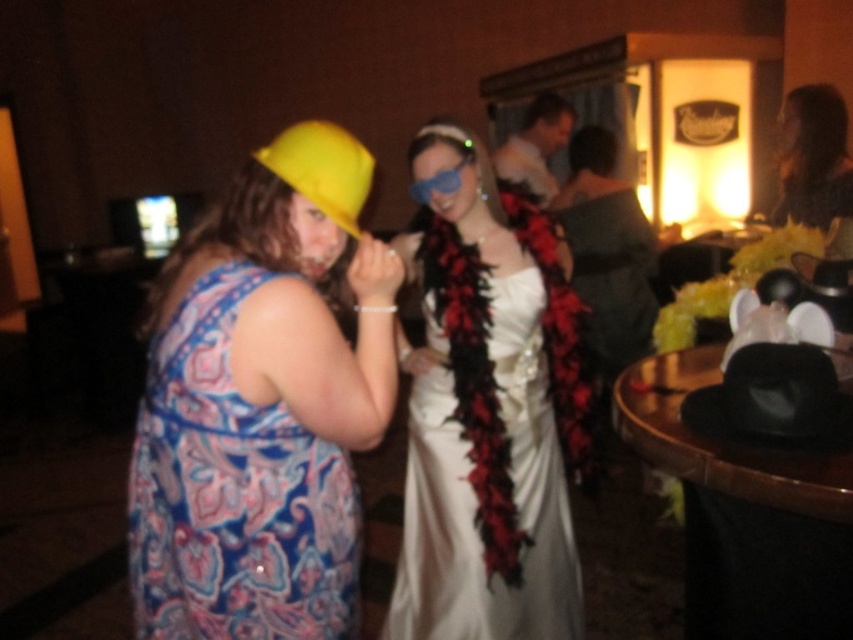
You are a photographer at the event and want to capture a photo of both the matte yellow hat at left and the smooth black dress at upper right in the same frame. The camera you are using has a maximum focus range of 2.5 meters. Will both subjects be in focus if you position yourself equidistant between them?

The matte yellow hat at left and the smooth black dress at upper right are 2.37 meters apart. If you position yourself equidistant between them, the distance from you to each subject would be half of 2.37 meters, which is approximately 1.185 meters. Since this is within the camera maximum focus range of 2.5 meters, both subjects will be in focus.

You are standing in the middle of the party scene. There are two points marked in the image. The first point is at coordinates point (305, 164) and the second point is at point (834, 168). Which of these two points is closer to you?

Point (305, 164) is closer to the viewer than point (834, 168).

You are a photographer at a party and need to adjust your camera to capture both the smooth black dress at upper right and the yellow fabric hat at upper left in the same frame. Based on their positions, which object is located to the right of the other?

The smooth black dress at upper right is positioned on the right side of yellow fabric hat at upper left.